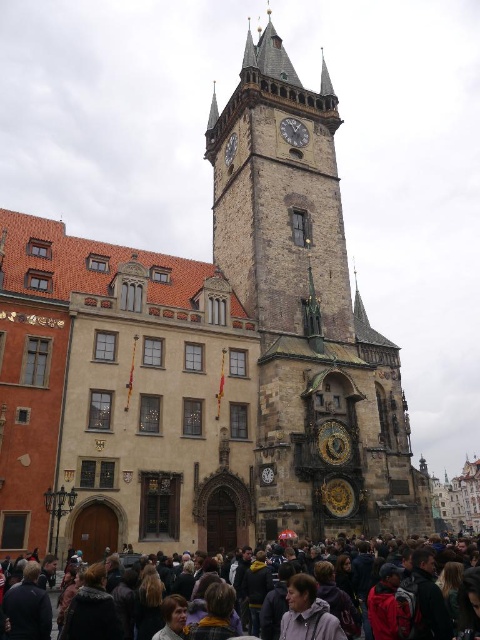
Question: Which object appears farthest from the camera in this image?

Choices:
 (A) dark gray stone clock at upper center
 (B) dark gray clothing at lower center
 (C) dark gray metallic clock at center
 (D) stone clock tower at center

Answer: (A)

Question: Is dark gray metallic clock at center bigger than dark gray stone clock at upper center?

Choices:
 (A) no
 (B) yes

Answer: (A)

Question: Where is dark gray metallic clock at center located in relation to dark gray stone clock at upper center in the image?

Choices:
 (A) below
 (B) above

Answer: (B)

Question: Among these points, which one is farthest from the camera?

Choices:
 (A) (479, 625)
 (B) (236, 138)
 (C) (298, 147)
 (D) (223, 198)

Answer: (D)

Question: Observing the image, what is the correct spatial positioning of dark gray metallic clock at center in reference to dark gray stone clock at upper center?

Choices:
 (A) right
 (B) left

Answer: (A)

Question: Which point appears farthest from the camera in this image?

Choices:
 (A) (232, 154)
 (B) (464, 548)
 (C) (301, 124)
 (D) (276, 305)

Answer: (A)